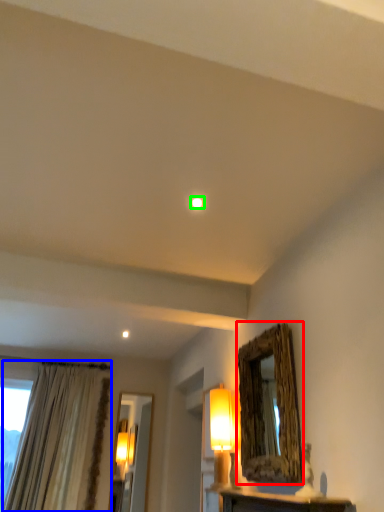
Question: Based on their relative distances, which object is farther from mirror (highlighted by a red box)? Choose from curtain (highlighted by a blue box) and lighting (highlighted by a green box).

Choices:
 (A) curtain
 (B) lighting

Answer: (A)